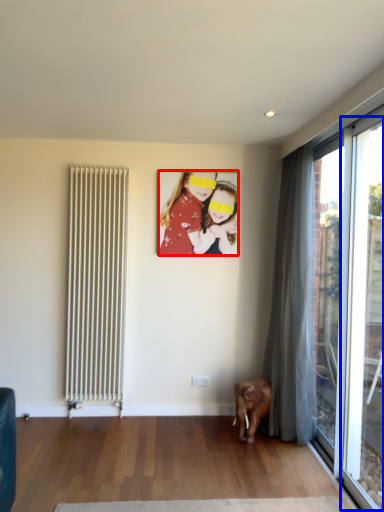
Question: Which object is further to the camera taking this photo, person (highlighted by a red box) or window (highlighted by a blue box)?

Choices:
 (A) person
 (B) window

Answer: (A)